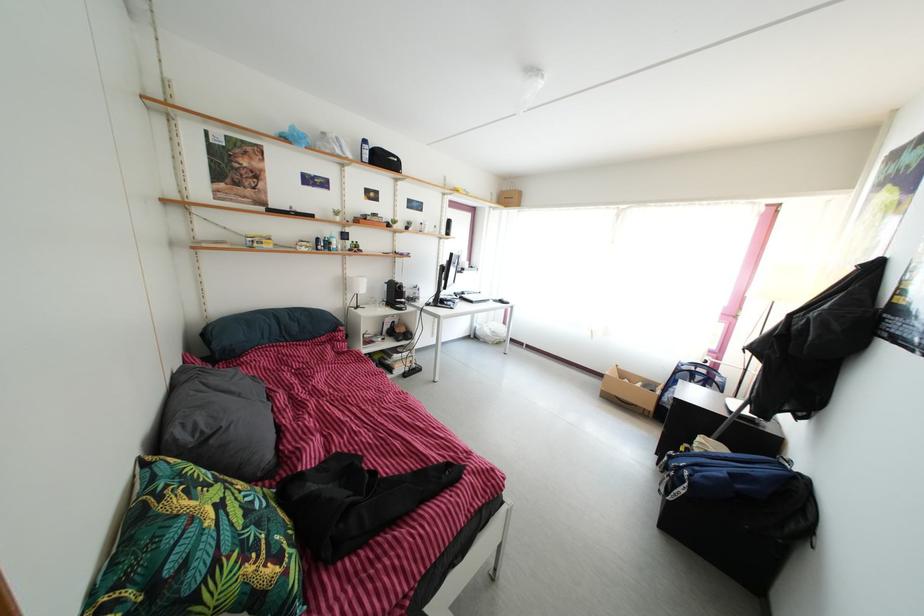
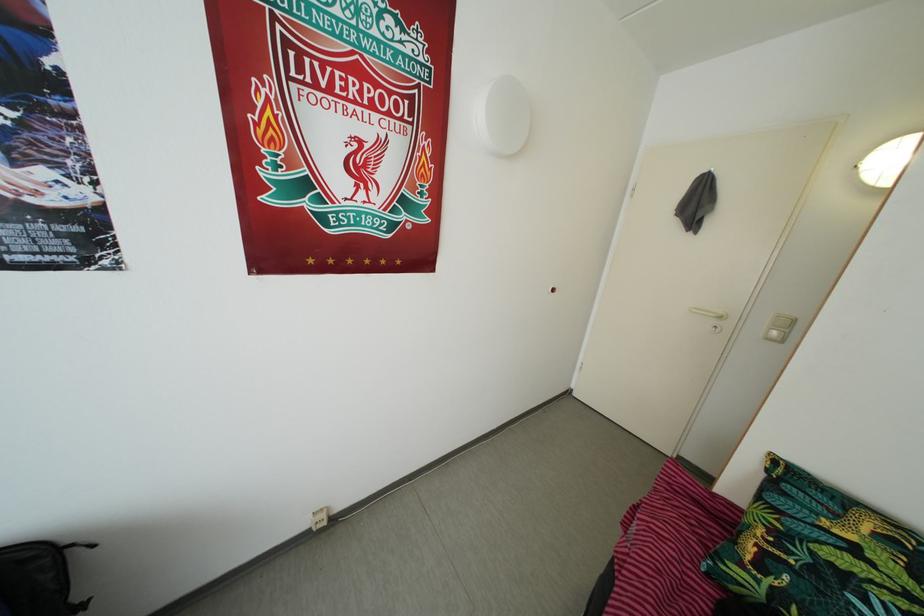
The point at (264, 533) is marked in the first image. Where is the corresponding point in the second image?

(820, 578)